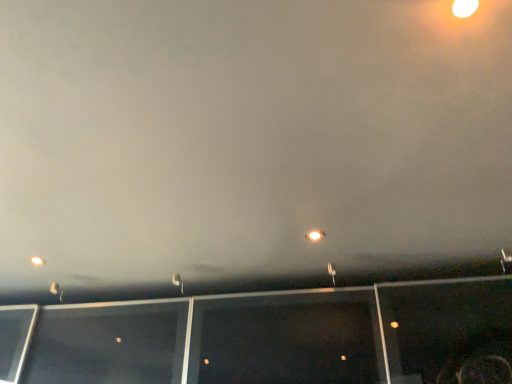
Describe the element at coordinates (57, 291) in the screenshot. Image resolution: width=512 pixels, height=384 pixels. I see `metallic street light at lower left, which ranks as the fourth street light in right-to-left order` at that location.

You are a GUI agent. You are given a task and a screenshot of the screen. Output one action in this format:
    pyautogui.click(x=<x>, y=<y>)
    Task: Click on the matte white light at center, which is the 4th street light in back-to-front order
    
    Given the screenshot: What is the action you would take?
    pyautogui.click(x=315, y=235)

How different are the orientations of metallic street light at lower left, placed as the 1th street light when sorted from back to front, and matte white light at center, the first street light in the front-to-back sequence, in degrees?

77.1 degrees.

Which is more to the left, metallic street light at lower left, the 1th street light from the bottom, or matte white light at center, the 3th street light when ordered from left to right?

Positioned to the left is metallic street light at lower left, the 1th street light from the bottom.

From a real-world perspective, who is located lower, metallic street light at lower left, placed as the 4th street light when sorted from front to back, or matte white light at center, which is the 4th street light in back-to-front order?

metallic street light at lower left, placed as the 4th street light when sorted from front to back, from a real-world perspective.

Is point (58, 295) positioned after point (307, 234)?

Yes.

Is metallic silver street light at center, the 4th street light positioned from the left, aimed at white plastic street light at center, which is the 3th street light in front-to-back order?

No, metallic silver street light at center, the 4th street light positioned from the left, does not turn towards white plastic street light at center, which is the 3th street light in front-to-back order.

Are metallic silver street light at center, the second street light when ordered from front to back, and white plastic street light at center, which is the 3th street light in front-to-back order, making contact?

No, metallic silver street light at center, the second street light when ordered from front to back, is not touching white plastic street light at center, which is the 3th street light in front-to-back order.

Is metallic silver street light at center, the second street light when ordered from front to back, at the right side of white plastic street light at center, which is the second street light in left-to-right order?

Indeed, metallic silver street light at center, the second street light when ordered from front to back, is positioned on the right side of white plastic street light at center, which is the second street light in left-to-right order.

Is metallic silver street light at center, the second street light when ordered from front to back, inside the boundaries of white plastic street light at center, the second street light positioned from the bottom, or outside?

metallic silver street light at center, the second street light when ordered from front to back, lies outside white plastic street light at center, the second street light positioned from the bottom.

At what (x,y) coordinates should I click in order to perform the action: click on the 2nd street light in front of the white plastic street light at center, which is the second street light in left-to-right order, starting your count from the anchor. Please return your answer as a coordinate pair (x, y). Looking at the image, I should click on (315, 235).

Which is correct: white plastic street light at center, acting as the 3th street light starting from the right, is inside matte white light at center, which is the 4th street light in back-to-front order, or outside of it?

white plastic street light at center, acting as the 3th street light starting from the right, cannot be found inside matte white light at center, which is the 4th street light in back-to-front order.

Considering the sizes of white plastic street light at center, the second street light positioned from the bottom, and matte white light at center, the fourth street light positioned from the bottom, in the image, is white plastic street light at center, the second street light positioned from the bottom, bigger or smaller than matte white light at center, the fourth street light positioned from the bottom,?

white plastic street light at center, the second street light positioned from the bottom, is bigger than matte white light at center, the fourth street light positioned from the bottom.

From the image's perspective, is white plastic street light at center, which appears as the second street light when viewed from the back, beneath matte white light at center, which is the 4th street light in back-to-front order?

Yes, from the image's perspective, white plastic street light at center, which appears as the second street light when viewed from the back, is below matte white light at center, which is the 4th street light in back-to-front order.

Can you confirm if metallic street light at lower left, placed as the 1th street light when sorted from back to front, is thinner than metallic silver street light at center, the 1th street light viewed from the right?

Correct, the width of metallic street light at lower left, placed as the 1th street light when sorted from back to front, is less than that of metallic silver street light at center, the 1th street light viewed from the right.

Based on the photo, in terms of size, does metallic street light at lower left, which ranks as the fourth street light in right-to-left order, appear bigger or smaller than metallic silver street light at center, marked as the second street light in a top-to-bottom arrangement?

In the image, metallic street light at lower left, which ranks as the fourth street light in right-to-left order, appears to be smaller than metallic silver street light at center, marked as the second street light in a top-to-bottom arrangement.

Which is closer, [58,290] or [330,265]?

Point [58,290] is farther from the camera than point [330,265].

From the image's perspective, which one is positioned higher, matte white light at center, which is the 4th street light in back-to-front order, or metallic silver street light at center, positioned as the third street light in bottom-to-top order?

matte white light at center, which is the 4th street light in back-to-front order, from the image's perspective.

From a real-world perspective, is matte white light at center, the 2th street light in the right-to-left sequence, physically located above or below metallic silver street light at center, the 4th street light positioned from the left?

In terms of real-world spatial position, matte white light at center, the 2th street light in the right-to-left sequence, is above metallic silver street light at center, the 4th street light positioned from the left.

Is matte white light at center, the 2th street light in the right-to-left sequence, positioned far away from metallic silver street light at center, the second street light when ordered from front to back?

No, there isn't a large distance between matte white light at center, the 2th street light in the right-to-left sequence, and metallic silver street light at center, the second street light when ordered from front to back.

Who is taller, matte white light at center, the 1th street light from the top, or metallic silver street light at center, the 3th street light when ordered from back to front?

With more height is metallic silver street light at center, the 3th street light when ordered from back to front.

Based on the photo, does matte white light at center, the 1th street light from the top, have a smaller size compared to white plastic street light at center, which appears as the second street light when viewed from the back?

Yes.

Is point (308, 232) closer to viewer compared to point (178, 285)?

Yes, it is in front of point (178, 285).

Is matte white light at center, the 3th street light when ordered from left to right, in contact with white plastic street light at center, acting as the third street light starting from the top?

There is a gap between matte white light at center, the 3th street light when ordered from left to right, and white plastic street light at center, acting as the third street light starting from the top.

How different are the orientations of matte white light at center, the first street light in the front-to-back sequence, and white plastic street light at center, which is the 3th street light in front-to-back order, in degrees?

There is a 77.1-degree angle between the facing directions of matte white light at center, the first street light in the front-to-back sequence, and white plastic street light at center, which is the 3th street light in front-to-back order.

Considering the sizes of objects metallic silver street light at center, the 4th street light positioned from the left, and matte white light at center, the fourth street light positioned from the bottom, in the image provided, who is thinner, metallic silver street light at center, the 4th street light positioned from the left, or matte white light at center, the fourth street light positioned from the bottom,?

With smaller width is matte white light at center, the fourth street light positioned from the bottom.

Is metallic silver street light at center, the second street light when ordered from front to back, bigger than matte white light at center, the 1th street light from the top?

Yes, metallic silver street light at center, the second street light when ordered from front to back, is bigger than matte white light at center, the 1th street light from the top.

How distant is metallic silver street light at center, the second street light when ordered from front to back, from matte white light at center, the first street light in the front-to-back sequence?

The distance of metallic silver street light at center, the second street light when ordered from front to back, from matte white light at center, the first street light in the front-to-back sequence, is 39.26 centimeters.

Can you tell me how much metallic silver street light at center, the 1th street light viewed from the right, and matte white light at center, the 2th street light in the right-to-left sequence, differ in facing direction?

There is a 81.5-degree angle between the facing directions of metallic silver street light at center, the 1th street light viewed from the right, and matte white light at center, the 2th street light in the right-to-left sequence.

From the metallic street light at lower left, which ranks as the fourth street light in right-to-left order, count 2nd street light to the right and point to it. Please provide its 2D coordinates.

[(315, 235)]

Find the location of a particular element. Image resolution: width=512 pixels, height=384 pixels. street light that is the 1st object located above the white plastic street light at center, which is the second street light in left-to-right order (from the image's perspective) is located at coordinates (332, 272).

When comparing their distances from metallic silver street light at center, the second street light when ordered from front to back, does metallic street light at lower left, which is the 4th street light in top-to-bottom order, or white plastic street light at center, acting as the third street light starting from the top, seem closer?

white plastic street light at center, acting as the third street light starting from the top, is positioned closer to the anchor metallic silver street light at center, the second street light when ordered from front to back.

Which object lies nearer to the anchor point metallic silver street light at center, marked as the second street light in a top-to-bottom arrangement, matte white light at center, the 2th street light in the right-to-left sequence, or metallic street light at lower left, placed as the 1th street light when sorted from back to front?

matte white light at center, the 2th street light in the right-to-left sequence.

Which object lies further to the anchor point metallic street light at lower left, which ranks as the fourth street light in right-to-left order, metallic silver street light at center, the second street light when ordered from front to back, or white plastic street light at center, which appears as the second street light when viewed from the back?

Among the two, metallic silver street light at center, the second street light when ordered from front to back, is located further to metallic street light at lower left, which ranks as the fourth street light in right-to-left order.

Considering their positions, is metallic silver street light at center, marked as the second street light in a top-to-bottom arrangement, positioned closer to white plastic street light at center, acting as the 3th street light starting from the right, than matte white light at center, which is the 4th street light in back-to-front order?

Among the two, metallic silver street light at center, marked as the second street light in a top-to-bottom arrangement, is located nearer to white plastic street light at center, acting as the 3th street light starting from the right.

Looking at the image, which one is located further to matte white light at center, the 3th street light when ordered from left to right, metallic silver street light at center, the 4th street light positioned from the left, or white plastic street light at center, which is the second street light in left-to-right order?

The object further to matte white light at center, the 3th street light when ordered from left to right, is white plastic street light at center, which is the second street light in left-to-right order.

Based on their spatial positions, is matte white light at center, the fourth street light positioned from the bottom, or metallic silver street light at center, the 4th street light positioned from the left, closer to white plastic street light at center, which is the second street light in left-to-right order?

Among the two, metallic silver street light at center, the 4th street light positioned from the left, is located nearer to white plastic street light at center, which is the second street light in left-to-right order.

From the image, which object appears to be nearer to white plastic street light at center, the second street light positioned from the bottom, matte white light at center, which is the 4th street light in back-to-front order, or metallic street light at lower left, the 1th street light from the bottom?

metallic street light at lower left, the 1th street light from the bottom, is positioned closer to the anchor white plastic street light at center, the second street light positioned from the bottom.

When comparing their distances from metallic silver street light at center, the 3th street light when ordered from back to front, does white plastic street light at center, acting as the 3th street light starting from the right, or matte white light at center, the 2th street light in the right-to-left sequence, seem closer?

matte white light at center, the 2th street light in the right-to-left sequence, lies closer to metallic silver street light at center, the 3th street light when ordered from back to front, than the other object.

Where is `street light between metallic street light at lower left, the 1th street light from the bottom, and matte white light at center, the 2th street light in the right-to-left sequence, in the horizontal direction`? The image size is (512, 384). street light between metallic street light at lower left, the 1th street light from the bottom, and matte white light at center, the 2th street light in the right-to-left sequence, in the horizontal direction is located at coordinates (178, 282).

I want to click on street light between white plastic street light at center, which appears as the second street light when viewed from the back, and metallic silver street light at center, the 4th street light positioned from the left, from left to right, so click(315, 235).